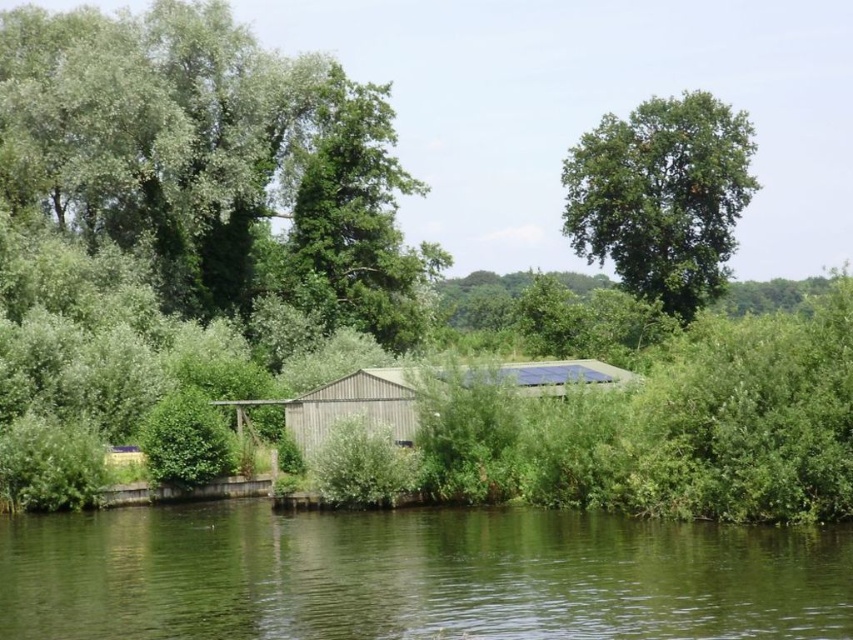
Does green smooth water at center have a smaller size compared to green leafy tree at upper right?

Yes.

Between green smooth water at center and green leafy tree at upper right, which one has more height?

green leafy tree at upper right

What are the coordinates of `green smooth water at center` in the screenshot? It's located at (415, 576).

The width and height of the screenshot is (853, 640). What are the coordinates of `green smooth water at center` in the screenshot? It's located at (415, 576).

Which is above, green smooth water at center or wooden shed at center?

Positioned higher is wooden shed at center.

Is green smooth water at center above wooden shed at center?

Actually, green smooth water at center is below wooden shed at center.

Who is more distant from viewer, (247, 628) or (306, 452)?

The point (306, 452) is more distant.

Find the location of a particular element. The width and height of the screenshot is (853, 640). green smooth water at center is located at coordinates (415, 576).

What do you see at coordinates (662, 196) in the screenshot? I see `green leafy tree at upper right` at bounding box center [662, 196].

Is the position of green leafy tree at upper right more distant than that of wooden shed at center?

Yes, green leafy tree at upper right is behind wooden shed at center.

Who is more forward, [572,236] or [518,381]?

Positioned in front is point [518,381].

This screenshot has height=640, width=853. In order to click on green leafy tree at upper right in this screenshot , I will do `click(662, 196)`.